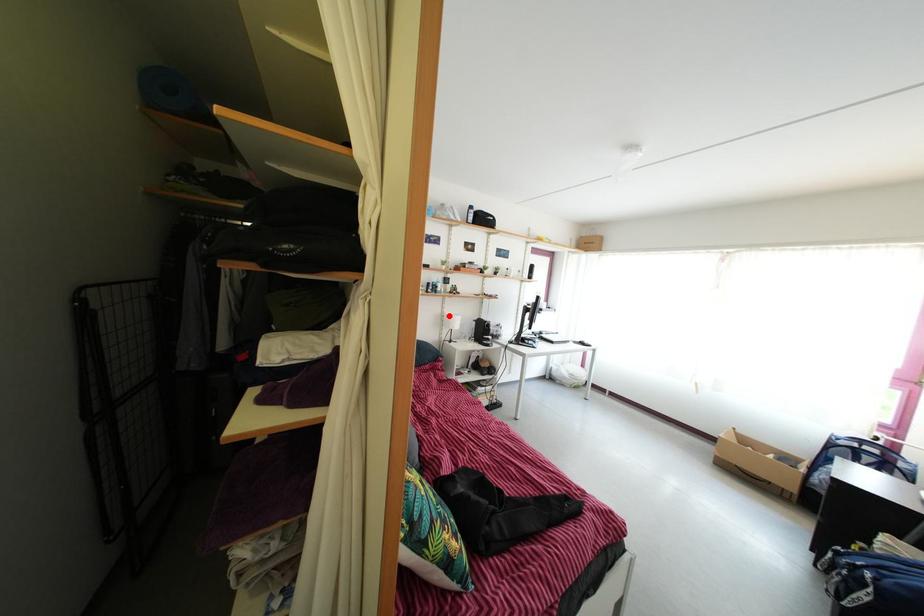
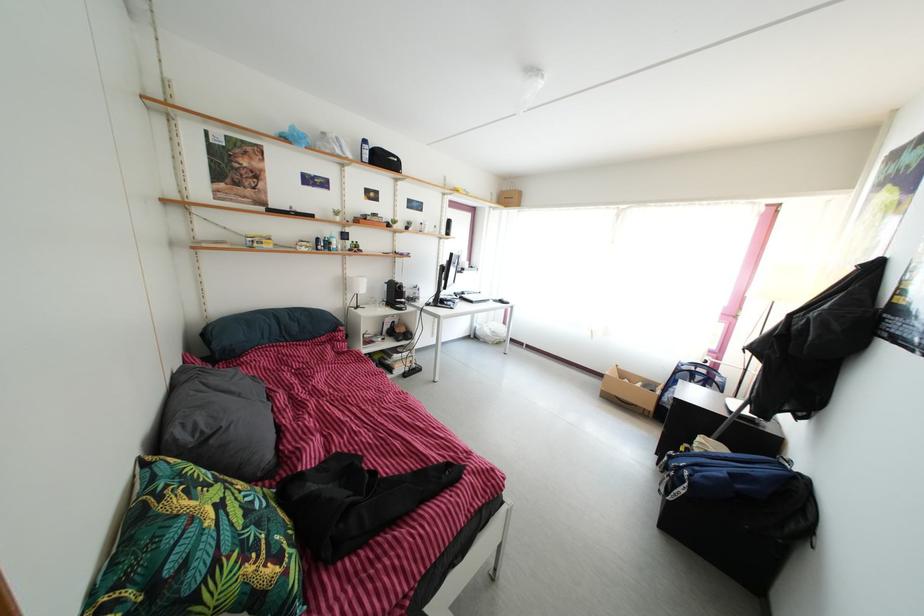
The point at the highlighted location is marked in the first image. Where is the corresponding point in the second image?

(350, 277)